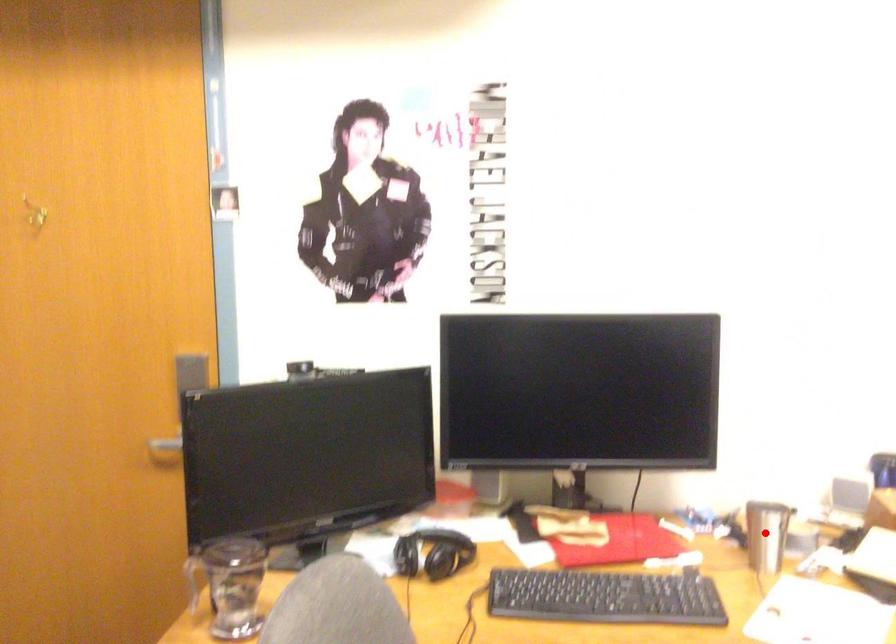
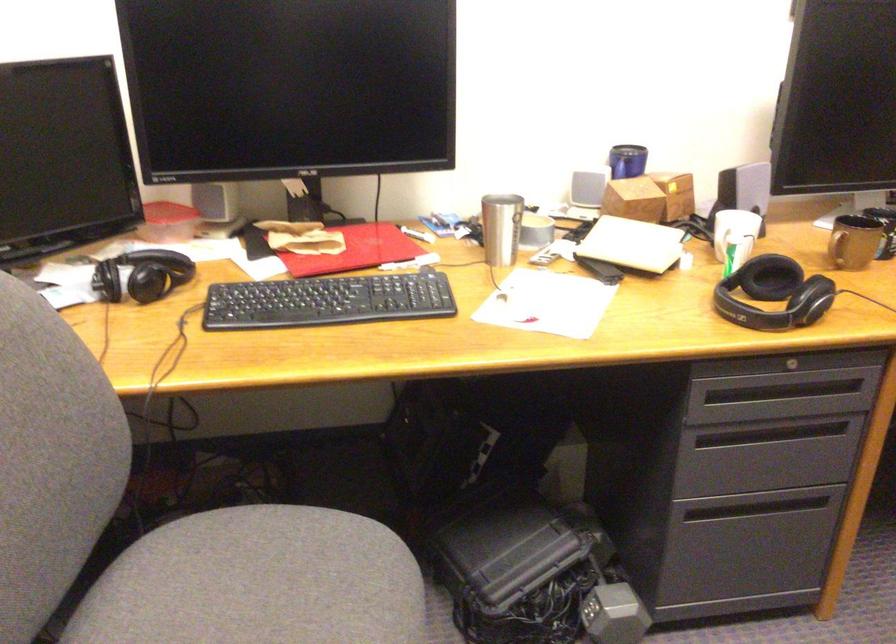
Where in the second image is the point corresponding to the highlighted location from the first image?

(501, 228)